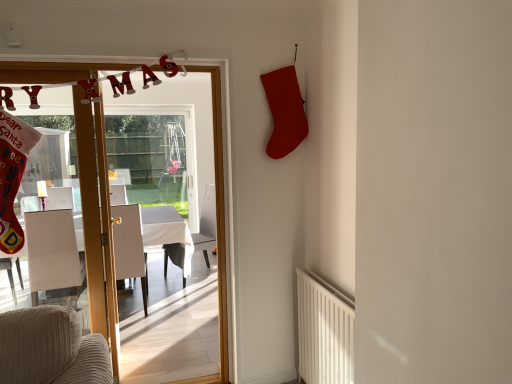
Question: Should I look upward or downward to see white textured radiator at lower right?

Choices:
 (A) down
 (B) up

Answer: (A)

Question: Would you say white fabric armchair at center, placed as the 2th armchair when sorted from left to right, is part of white glossy table at left's contents?

Choices:
 (A) yes
 (B) no

Answer: (A)

Question: Is white glossy table at left positioned with its back to white fabric armchair at center, placed as the 2th armchair when sorted from left to right?

Choices:
 (A) no
 (B) yes

Answer: (A)

Question: Is white glossy table at left far away from white fabric armchair at center, which appears as the 2th armchair when viewed from the right?

Choices:
 (A) yes
 (B) no

Answer: (B)

Question: Is white glossy table at left facing towards white fabric armchair at center, placed as the 2th armchair when sorted from left to right?

Choices:
 (A) no
 (B) yes

Answer: (A)

Question: Is white glossy table at left positioned in front of white fabric armchair at center, placed as the 2th armchair when sorted from left to right?

Choices:
 (A) yes
 (B) no

Answer: (A)

Question: Considering the relative sizes of white glossy table at left and white fabric armchair at center, placed as the 2th armchair when sorted from left to right, in the image provided, is white glossy table at left taller than white fabric armchair at center, placed as the 2th armchair when sorted from left to right,?

Choices:
 (A) no
 (B) yes

Answer: (A)

Question: Is white textured radiator at lower right oriented towards white fabric armchair at left, marked as the 3th armchair in a right-to-left arrangement?

Choices:
 (A) yes
 (B) no

Answer: (B)

Question: From a real-world perspective, is white textured radiator at lower right under white fabric armchair at left, which ranks as the 1th armchair in left-to-right order?

Choices:
 (A) no
 (B) yes

Answer: (B)

Question: Is white textured radiator at lower right oriented away from white fabric armchair at left, which ranks as the 1th armchair in left-to-right order?

Choices:
 (A) yes
 (B) no

Answer: (B)

Question: Can you confirm if white textured radiator at lower right is bigger than white fabric armchair at left, marked as the 3th armchair in a right-to-left arrangement?

Choices:
 (A) yes
 (B) no

Answer: (B)

Question: From a real-world perspective, is white textured radiator at lower right located higher than white fabric armchair at left, which ranks as the 1th armchair in left-to-right order?

Choices:
 (A) yes
 (B) no

Answer: (B)

Question: Does white textured radiator at lower right have a greater height compared to white fabric armchair at left, which ranks as the 1th armchair in left-to-right order?

Choices:
 (A) yes
 (B) no

Answer: (B)

Question: Considering the relative sizes of white glossy door at center and white fabric armchair at center, which appears as the 2th armchair when viewed from the right, in the image provided, is white glossy door at center thinner than white fabric armchair at center, which appears as the 2th armchair when viewed from the right,?

Choices:
 (A) no
 (B) yes

Answer: (B)